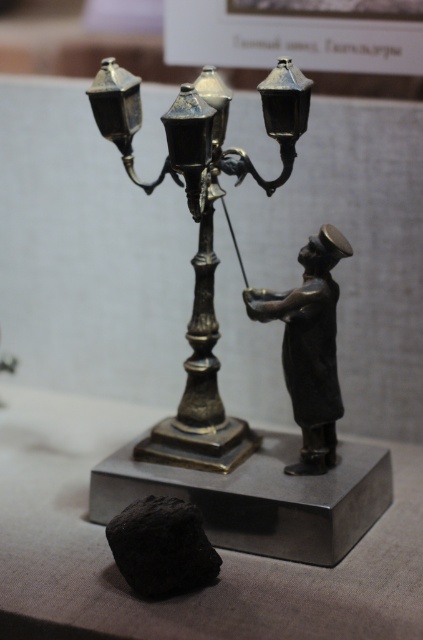
Question: Considering the real-world distances, which object is closest to the polished brass lamp at center?

Choices:
 (A) bronze figurine at right
 (B) black matte rock at lower left

Answer: (A)

Question: Does polished brass lamp at center have a greater width compared to black matte rock at lower left?

Choices:
 (A) yes
 (B) no

Answer: (A)

Question: Which point is closer to the camera?

Choices:
 (A) (206, 545)
 (B) (279, 308)

Answer: (A)

Question: Among these points, which one is farthest from the camera?

Choices:
 (A) (304, 362)
 (B) (200, 202)
 (C) (173, 577)

Answer: (A)

Question: Is polished brass lamp at center smaller than bronze figurine at right?

Choices:
 (A) yes
 (B) no

Answer: (B)

Question: Does polished brass lamp at center appear over black matte rock at lower left?

Choices:
 (A) no
 (B) yes

Answer: (B)